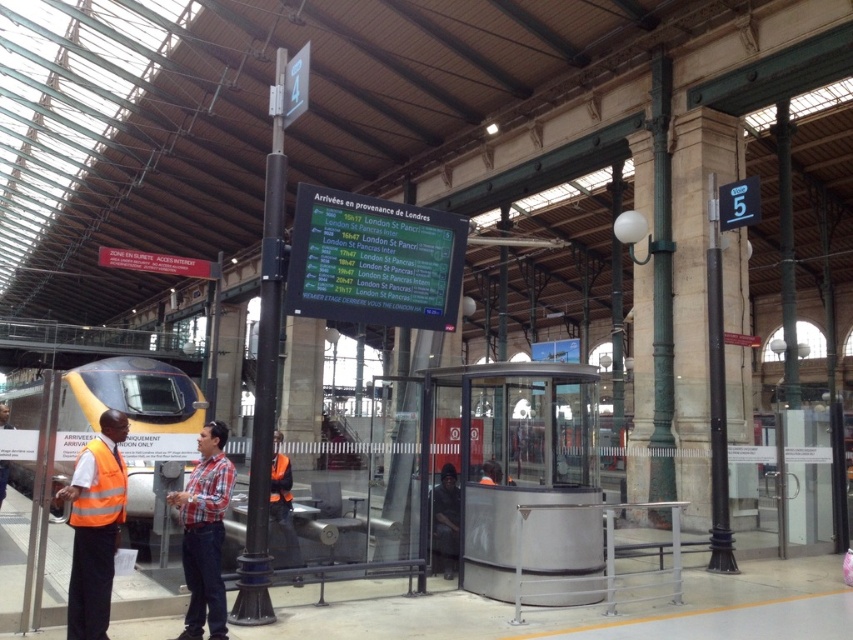
You are a passenger at the train station and want to locate two specific points marked on the floor. The first point is at coordinate point(90, 410) and the second is at point(201, 470). From your vantage point near the entrance, which point is closer to you?

Point(201, 470) is closer to you because point(90, 410) is behind it.

You are a traveler at the train station and you see a high visibility vest at left and a plaid shirt at center. Which clothing item is higher up from the ground?

The high visibility vest at left is above the plaid shirt at center, so it is higher up from the ground.

You are a maintenance worker in the train station. You need to reach the plaid shirt at center from the high visibility vest at left. What is the approximate distance you need to cover?

The distance between the high visibility vest at left and the plaid shirt at center is 31.43 inches, so you need to cover approximately 31.43 inches to reach the plaid shirt at center from the high visibility vest at left.